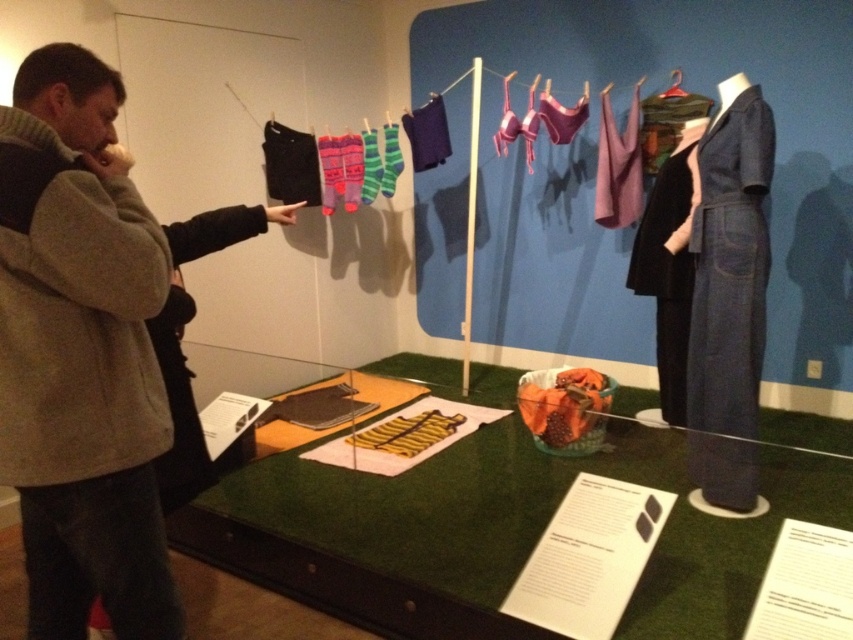
Question: Which point is farther from the camera taking this photo?

Choices:
 (A) pyautogui.click(x=120, y=486)
 (B) pyautogui.click(x=672, y=112)

Answer: (B)

Question: Is matte fabric clothesline at center above black matte suit at right?

Choices:
 (A) yes
 (B) no

Answer: (A)

Question: Among these points, which one is nearest to the camera?

Choices:
 (A) (50, 333)
 (B) (251, 544)
 (C) (659, 136)
 (D) (657, 211)

Answer: (A)

Question: Which point appears farthest from the camera in this image?

Choices:
 (A) (668, 368)
 (B) (38, 390)
 (C) (432, 102)
 (D) (734, 180)

Answer: (C)

Question: Does green felt table at center have a smaller size compared to matte fabric clothesline at center?

Choices:
 (A) no
 (B) yes

Answer: (A)

Question: Does green felt table at center have a greater width compared to black matte suit at right?

Choices:
 (A) yes
 (B) no

Answer: (A)